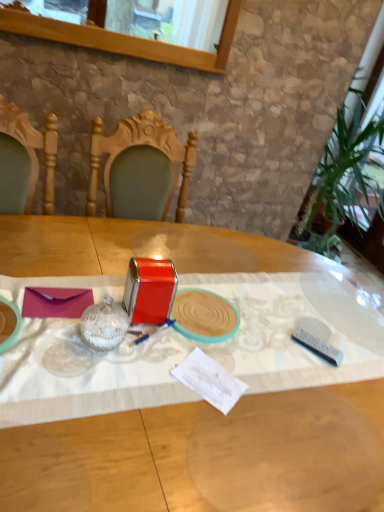
Image resolution: width=384 pixels, height=512 pixels. In order to click on free location in front of clear glass jar at center, acting as the 1th tableware starting from the left in this screenshot , I will do point(81,392).